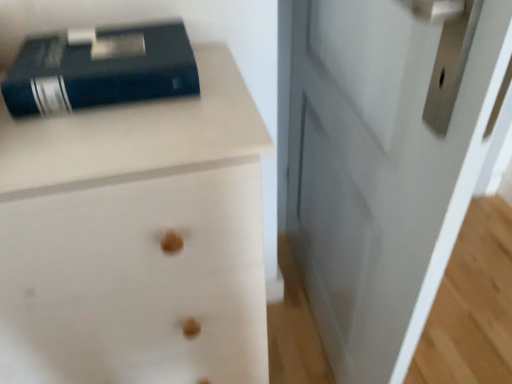
Question: Should I look upward or downward to see matte black book at upper left?

Choices:
 (A) up
 (B) down

Answer: (A)

Question: From a real-world perspective, is matte black book at upper left physically below white glossy door at center?

Choices:
 (A) no
 (B) yes

Answer: (A)

Question: From the image's perspective, is matte black book at upper left beneath white glossy door at center?

Choices:
 (A) yes
 (B) no

Answer: (B)

Question: Considering the relative sizes of matte black book at upper left and white glossy door at center in the image provided, is matte black book at upper left thinner than white glossy door at center?

Choices:
 (A) no
 (B) yes

Answer: (A)

Question: Is matte black book at upper left far away from white glossy door at center?

Choices:
 (A) yes
 (B) no

Answer: (B)

Question: Can white glossy door at center be found inside matte black book at upper left?

Choices:
 (A) no
 (B) yes

Answer: (A)

Question: From a real-world perspective, is matte black book at upper left on top of white glossy door at center?

Choices:
 (A) yes
 (B) no

Answer: (A)

Question: Is matte black book at upper left touching white wood chest of drawers at upper left?

Choices:
 (A) no
 (B) yes

Answer: (A)

Question: Does matte black book at upper left come behind white wood chest of drawers at upper left?

Choices:
 (A) no
 (B) yes

Answer: (B)

Question: Can you confirm if matte black book at upper left is taller than white wood chest of drawers at upper left?

Choices:
 (A) no
 (B) yes

Answer: (A)

Question: Is matte black book at upper left wider than white wood chest of drawers at upper left?

Choices:
 (A) yes
 (B) no

Answer: (B)

Question: From a real-world perspective, is matte black book at upper left positioned over white wood chest of drawers at upper left based on gravity?

Choices:
 (A) no
 (B) yes

Answer: (B)

Question: Is matte black book at upper left shorter than white wood chest of drawers at upper left?

Choices:
 (A) yes
 (B) no

Answer: (A)

Question: Does white wood chest of drawers at upper left have a greater width compared to white glossy door at center?

Choices:
 (A) yes
 (B) no

Answer: (A)